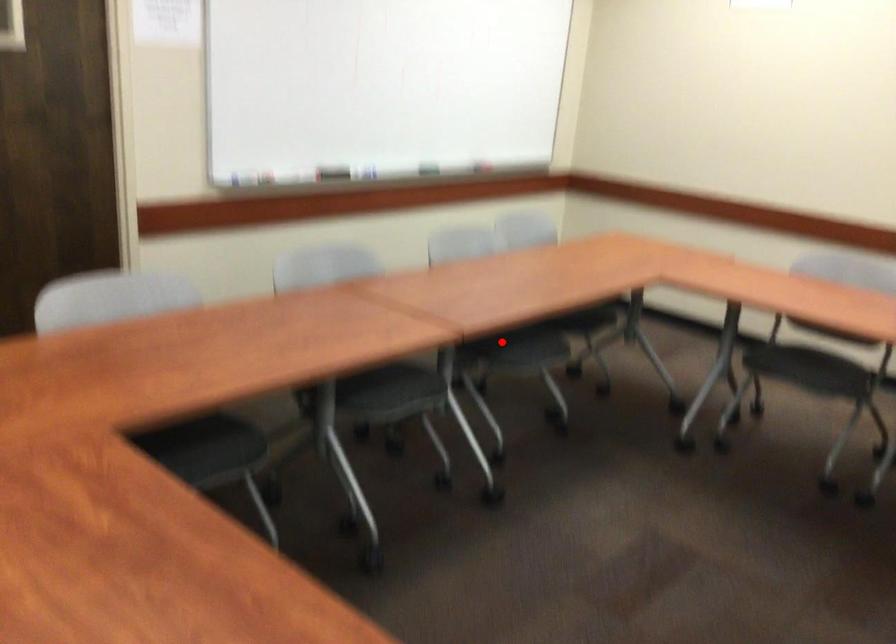
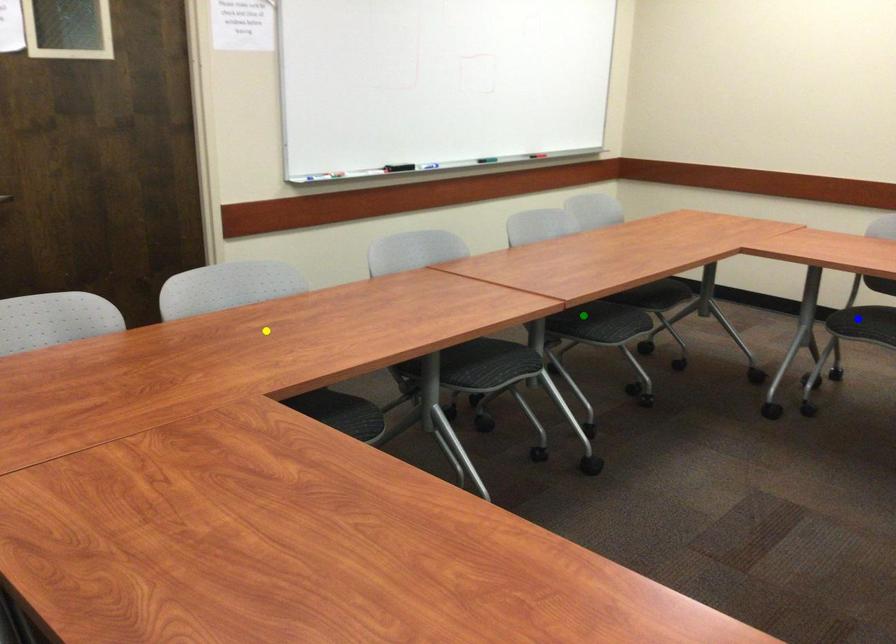
Question: I am providing you with two images of the same scene from different viewpoints. A red point is marked on the first image. You are given multiple points on the second image. Which spot in image 2 lines up with the point in image 1?

Choices:
 (A) yellow point
 (B) blue point
 (C) green point

Answer: (C)